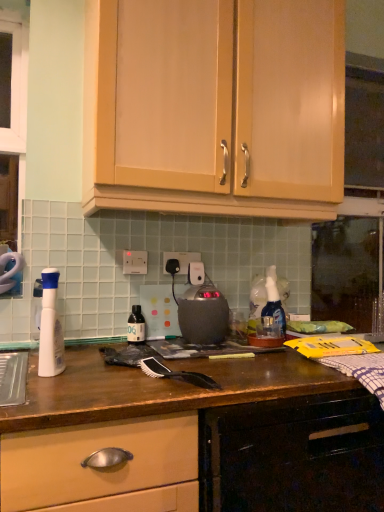
Find the location of a particular element. This screenshot has width=384, height=512. vacant space underneath satin black kettle at center (from a real-world perspective) is located at coordinates 205,338.